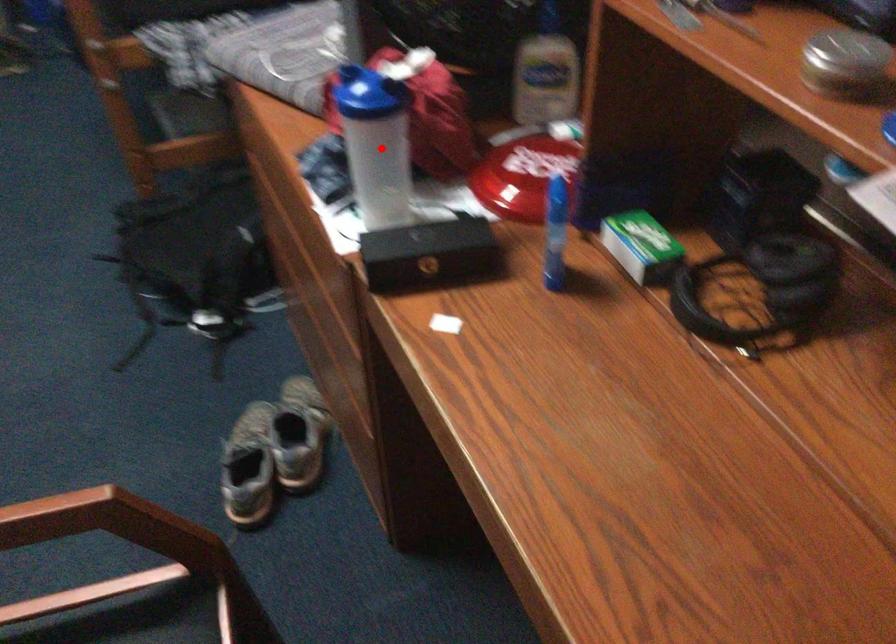
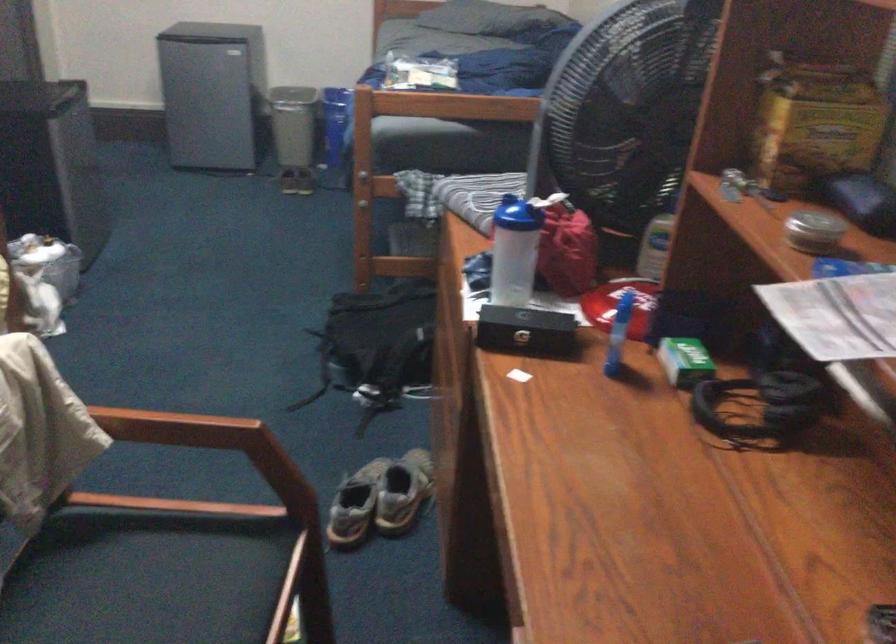
Question: A red point is marked in image1. In image2, is the corresponding 3D point closer to the camera or farther? Reply with the corresponding letter.

Choices:
 (A) The corresponding 3D point is closer.
 (B) The corresponding 3D point is farther.

Answer: (B)